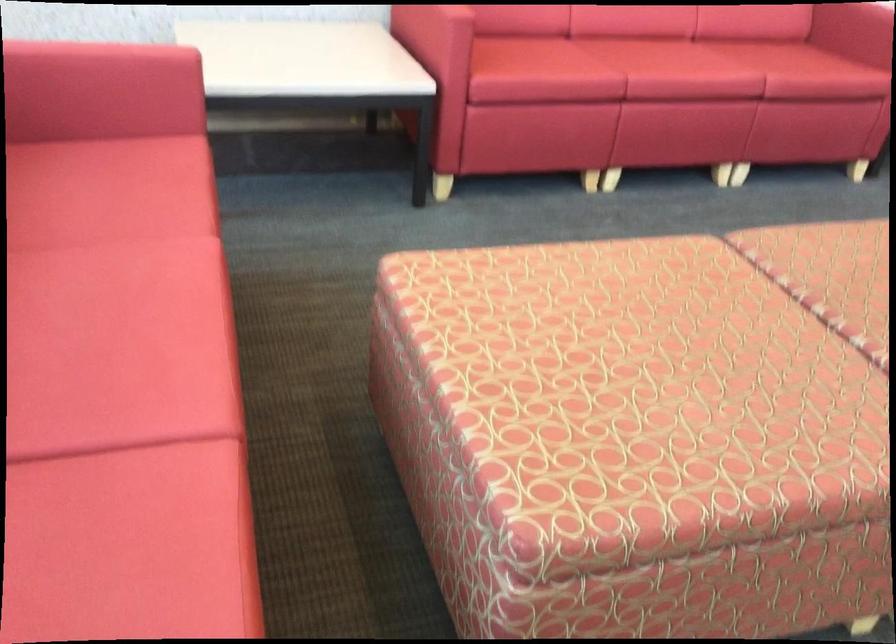
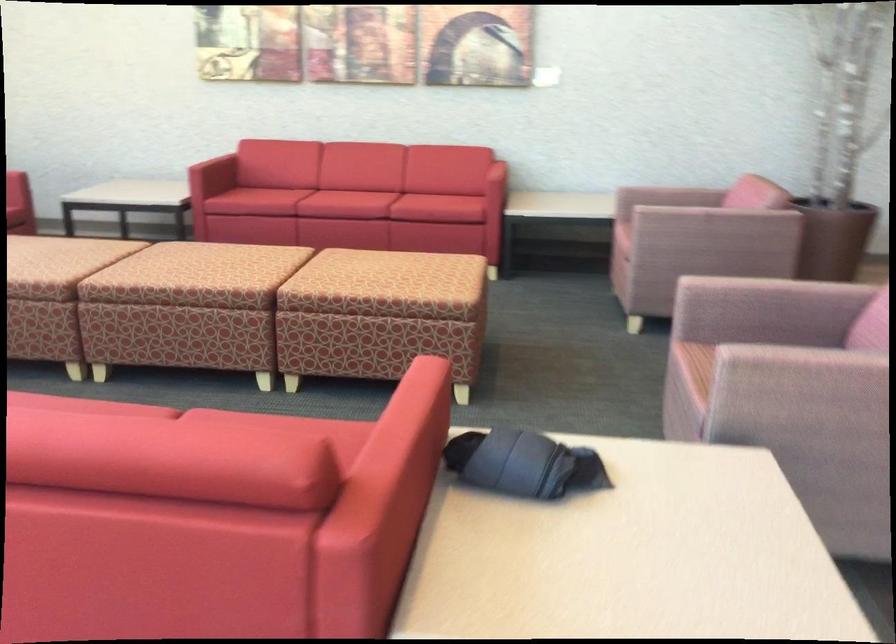
Question: I am providing you with two images of the same scene from different viewpoints. After the viewpoint changes to image2, which objects are now occluded?

Choices:
 (A) pink chair armrest
 (B) patterned ottoman surface
 (C) red sofa armrest
 (D) none of these

Answer: (D)